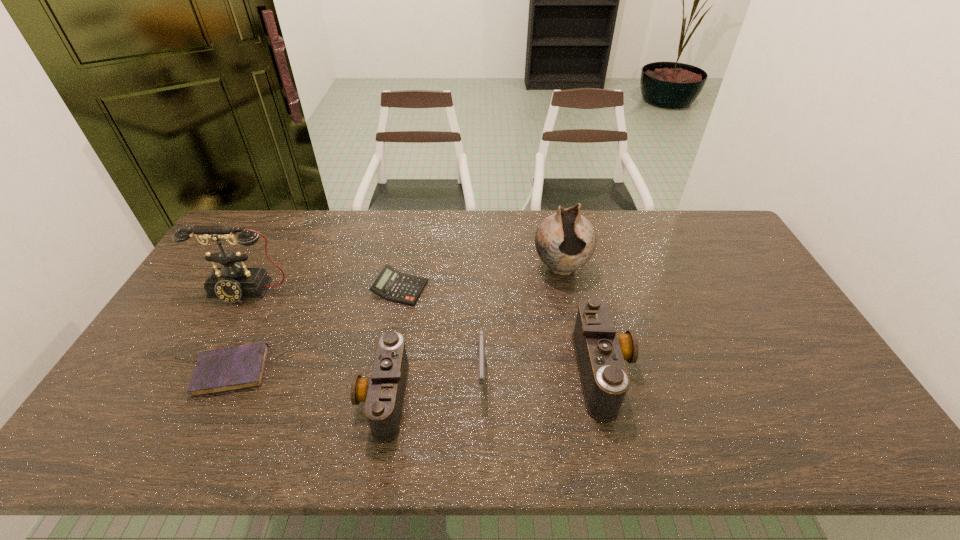
This screenshot has height=540, width=960. Identify the location of blank area located 0.310m on the lens of the left camera. (237, 396).

At what (x,y) coordinates should I click in order to perform the action: click on free space located 0.340m on the lens of the third tallest object. Please return your answer as a coordinate pair (x, y). Looking at the image, I should click on (758, 370).

The image size is (960, 540). In order to click on vacant space situated on the back of the calculator in this screenshot , I will do `click(414, 214)`.

This screenshot has height=540, width=960. I want to click on vacant space situated on the dial of the telephone, so click(x=189, y=394).

Find the location of a particular element. vacant area situated from the spout of the pottery is located at coordinates (581, 366).

Image resolution: width=960 pixels, height=540 pixels. I want to click on vacant space located 0.360m on the back of the diary, so click(x=286, y=261).

This screenshot has height=540, width=960. I want to click on object that is at the far edge, so [565, 241].

Identify the location of pistol at the near edge. (481, 343).

Identify the location of diary that is at the near edge. Image resolution: width=960 pixels, height=540 pixels. (226, 369).

This screenshot has height=540, width=960. Find the location of `telephone positioned at the left edge`. telephone positioned at the left edge is located at coordinates (233, 281).